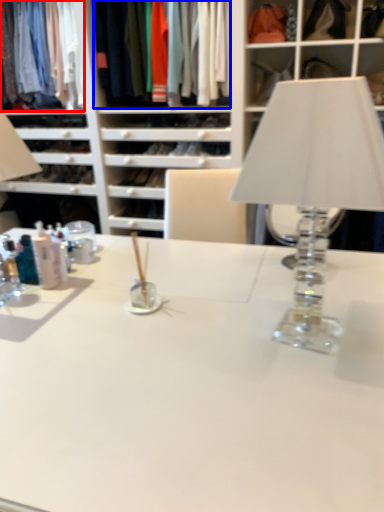
Question: Among these objects, which one is farthest to the camera, clothing (highlighted by a red box) or clothing (highlighted by a blue box)?

Choices:
 (A) clothing
 (B) clothing

Answer: (A)